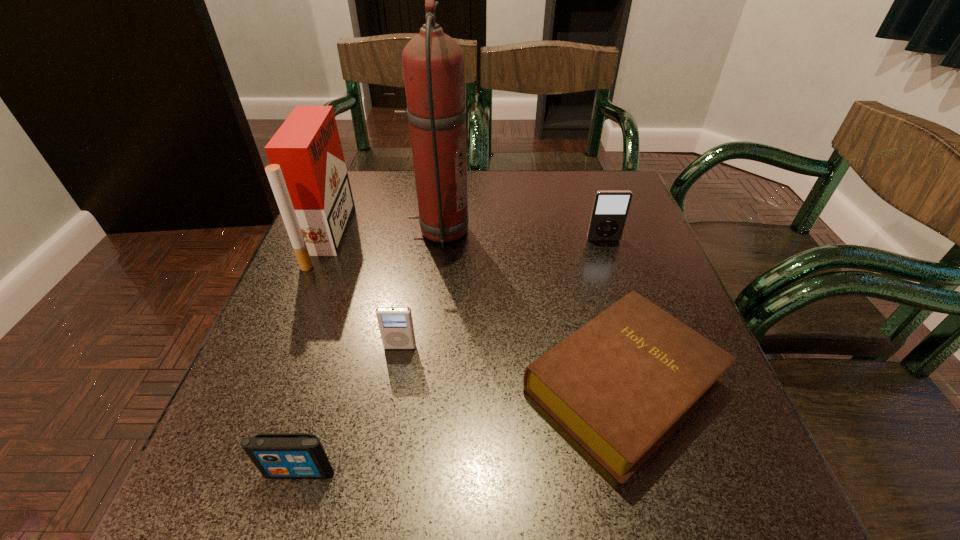
At what (x,y) coordinates should I click in order to perform the action: click on the fifth closest object relative to the Bible. Please return your answer as a coordinate pair (x, y). This screenshot has width=960, height=540. Looking at the image, I should click on (307, 173).

Identify which object is the fifth closest to the tallest object. Please provide its 2D coordinates. Your answer should be formatted as a tuple, i.e. [(x, y)], where the tuple contains the x and y coordinates of a point satisfying the conditions above.

[(276, 455)]

Locate an element on the screen. This screenshot has width=960, height=540. the closest iPod to the second farthest iPod is located at coordinates (276, 455).

The width and height of the screenshot is (960, 540). Identify the location of iPod that stands as the closest to the cigarette case. (396, 328).

Where is `vacant region that satisfies the following two spatial constraints: 1. on the side of the fire extinguisher with the label and nozzle; 2. on the back side of the Bible`? Image resolution: width=960 pixels, height=540 pixels. vacant region that satisfies the following two spatial constraints: 1. on the side of the fire extinguisher with the label and nozzle; 2. on the back side of the Bible is located at coordinates (422, 384).

You are a GUI agent. You are given a task and a screenshot of the screen. Output one action in this format:
    pyautogui.click(x=<x>, y=<y>)
    Task: Click on the free location that satisfies the following two spatial constraints: 1. on the side of the fire extinguisher with the label and nozzle; 2. on the left side of the Bible
    The width and height of the screenshot is (960, 540).
    Given the screenshot: What is the action you would take?
    pyautogui.click(x=422, y=384)

This screenshot has width=960, height=540. I want to click on vacant region that satisfies the following two spatial constraints: 1. on the side of the fire extinguisher with the label and nozzle; 2. on the front screen of the second object from left to right, so click(413, 472).

Locate an element on the screen. vacant area in the image that satisfies the following two spatial constraints: 1. on the side of the fire extinguisher with the label and nozzle; 2. on the right side of the shortest object is located at coordinates (422, 384).